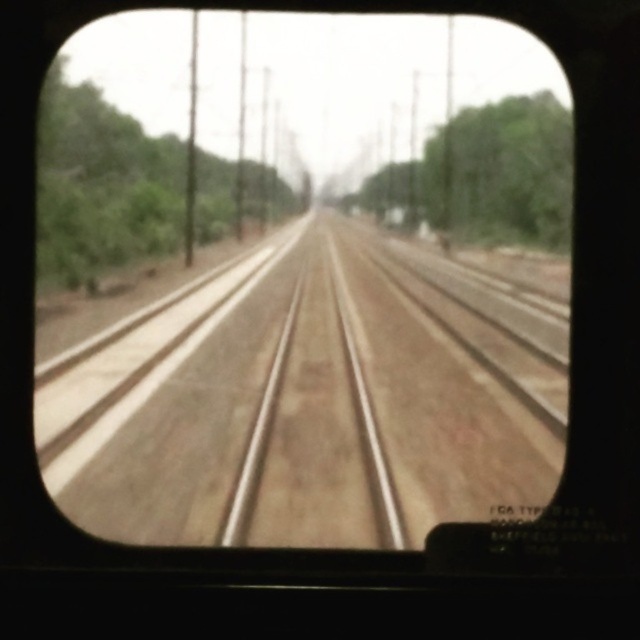
Which is more to the left, brown dirt track at center or green leafy tree at left?

Positioned to the left is green leafy tree at left.

Which is more to the right, brown dirt track at center or green leafy tree at left?

brown dirt track at center is more to the right.

Which is behind, point (132, 452) or point (38, 284)?

Point (132, 452)

This screenshot has width=640, height=640. In order to click on brown dirt track at center in this screenshot , I will do `click(317, 404)`.

The width and height of the screenshot is (640, 640). Describe the element at coordinates (129, 189) in the screenshot. I see `green leafy tree at left` at that location.

Who is more distant from viewer, [166,200] or [497,134]?

The point [166,200] is behind.

You are a GUI agent. You are given a task and a screenshot of the screen. Output one action in this format:
    pyautogui.click(x=<x>, y=<y>)
    Task: Click on the green leafy tree at left
    Image resolution: width=640 pixels, height=640 pixels.
    Given the screenshot: What is the action you would take?
    pyautogui.click(x=129, y=189)

Is brown dirt track at center to the right of green leafy tree at center from the viewer's perspective?

In fact, brown dirt track at center is to the left of green leafy tree at center.

Looking at this image, does brown dirt track at center lie behind green leafy tree at center?

No, it is in front of green leafy tree at center.

Which is behind, point (451, 499) or point (532, 182)?

The point (532, 182) is behind.

You are a GUI agent. You are given a task and a screenshot of the screen. Output one action in this format:
    pyautogui.click(x=<x>, y=<y>)
    Task: Click on the brown dirt track at center
    This screenshot has height=640, width=640.
    Given the screenshot: What is the action you would take?
    pyautogui.click(x=317, y=404)